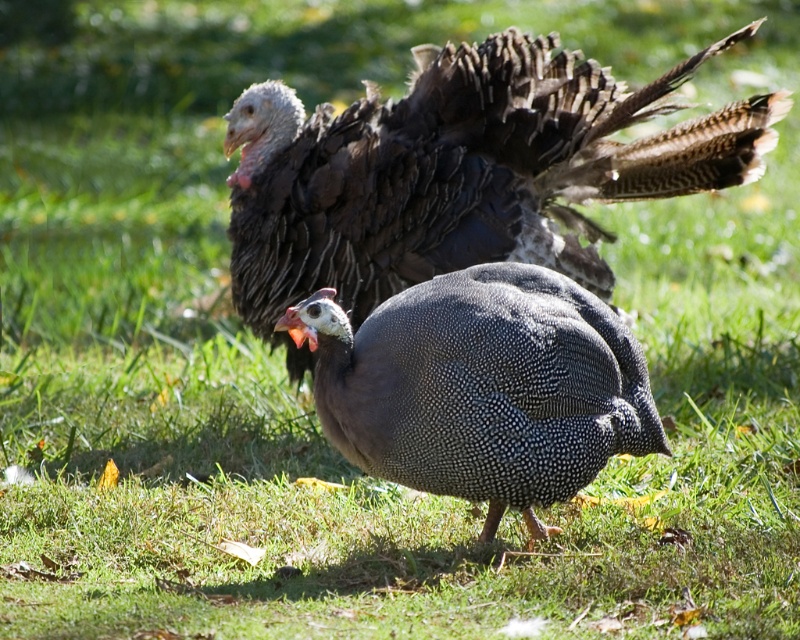
In the scene shown: Which is more to the right, dark brown feathers at upper center or speckled feathered guinea fowl at center?

dark brown feathers at upper center

Between point (750, 161) and point (454, 400), which one is positioned behind?

Positioned behind is point (750, 161).

Is point (633, 122) closer to viewer compared to point (502, 262)?

No, (633, 122) is behind (502, 262).

Where is `dark brown feathers at upper center`? The image size is (800, 640). dark brown feathers at upper center is located at coordinates (462, 172).